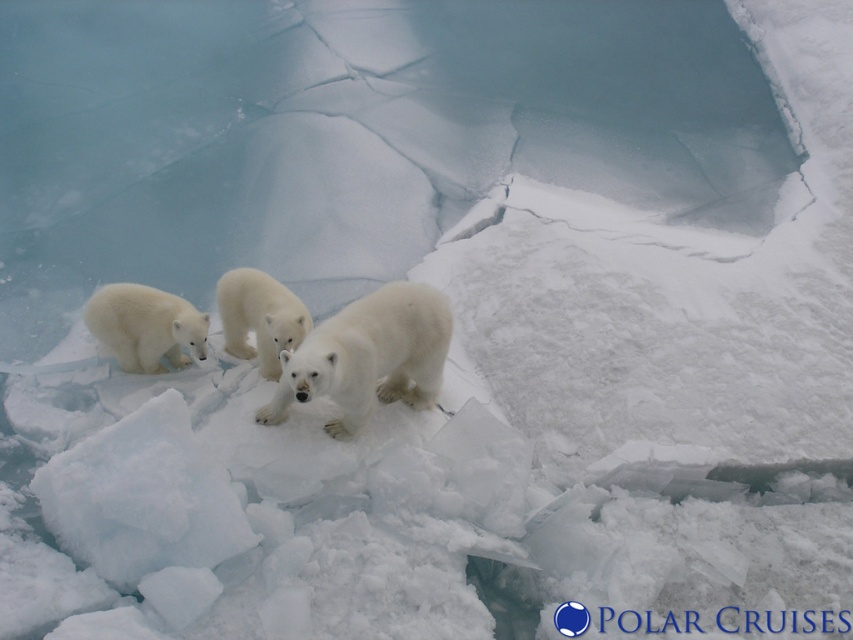
Between white fluffy bear at center and white fluffy bear cub at lower left, which one is positioned higher?

white fluffy bear cub at lower left is higher up.

Between point (339, 314) and point (109, 300), which one is positioned in front?

Positioned in front is point (339, 314).

Identify the location of white fluffy bear at center. The image size is (853, 640). (368, 356).

Can you confirm if white fluffy bear cub at lower left is thinner than white fur bear at center?

Incorrect, white fluffy bear cub at lower left's width is not less than white fur bear at center's.

Is point (135, 342) more distant than point (268, 305)?

That is True.

Find the location of `white fluffy bear cub at lower left`. white fluffy bear cub at lower left is located at coordinates (144, 326).

Does white fluffy bear at center have a larger size compared to white fur bear at center?

Yes.

Where is `white fluffy bear at center`? This screenshot has height=640, width=853. white fluffy bear at center is located at coordinates (368, 356).

Image resolution: width=853 pixels, height=640 pixels. Find the location of `white fluffy bear at center`. white fluffy bear at center is located at coordinates (368, 356).

I want to click on white fluffy bear at center, so click(x=368, y=356).